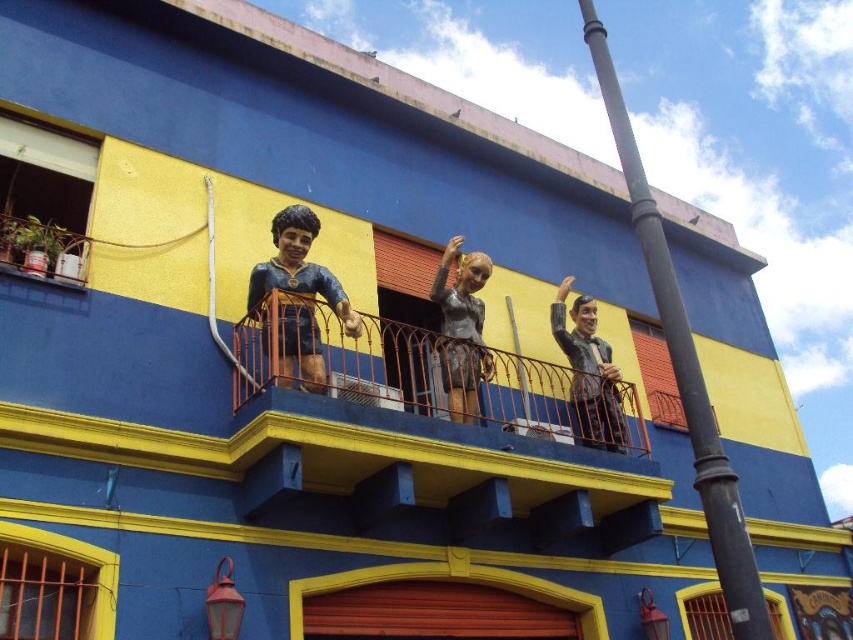
You are standing in front of the building and notice two points marked on the facade. The first point is at coordinates point (442, 337) and the second is at point (474, 390). Which point is closer to you?

Point (442, 337) is in front of point (474, 390), so it is closer to you.

You are an art student observing the building facade. You notice two statues on the balcony. Which statue is placed higher up between the shiny gold statue at center and the shiny silver statue at center?

The shiny gold statue at center is placed higher up than the shiny silver statue at center.

You are standing in front of the building and want to know the exact position of the orange metal railing at upper center. Can you determine its coordinates?

The orange metal railing at upper center is located at point (x=434, y=376).